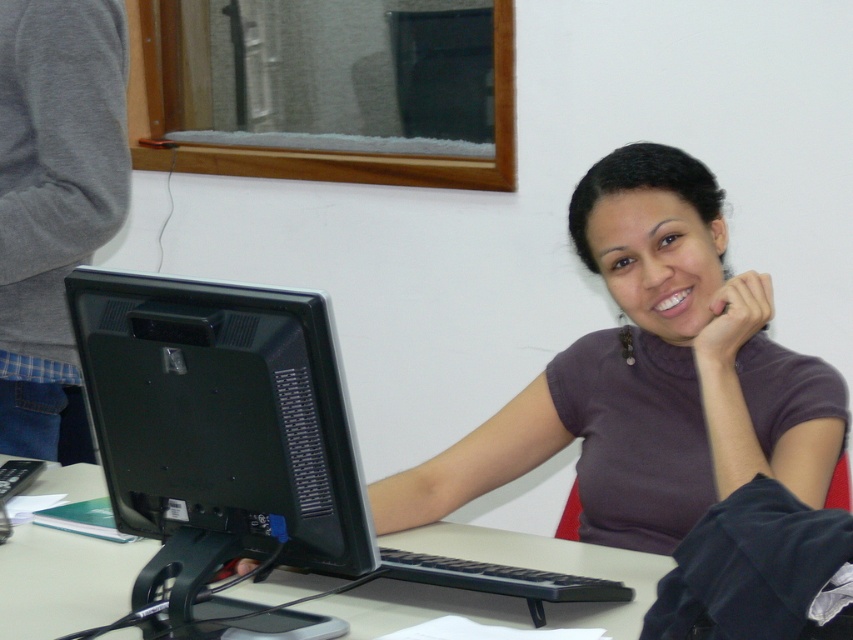
You are a photographer standing at a certain distance from the desk. You want to take a photo of the matte purple shirt at center so that it appears large enough in the frame. Given that the shirt is 5.23 feet away from the camera, would you need to move closer or farther away to make it larger?

The matte purple shirt at center is currently 5.23 feet away from the camera. To make it appear larger in the photo, you should move closer to the shirt, decreasing the distance between the camera and the shirt.

You are organizing a small party and need to place a 1.5 square meter tablecloth on the desk. Given the size of the black plastic monitor at center and white plastic computer desk at center, will the tablecloth fit over the desk without covering the monitor?

The black plastic monitor at center occupies less space than the white plastic computer desk at center, so the 1.5 square meter tablecloth should fit over the desk without covering the monitor, provided the desk itself is large enough to accommodate the tablecloth.

You are a delivery person who needs to place a small package on the desk without covering the keyboard. Given that the matte purple shirt at center is over the white plastic computer desk at center, where should you place the package?

The matte purple shirt at center is positioned over the white plastic computer desk at center, so you should place the package on the desk area not covered by the shirt, ensuring it doesn